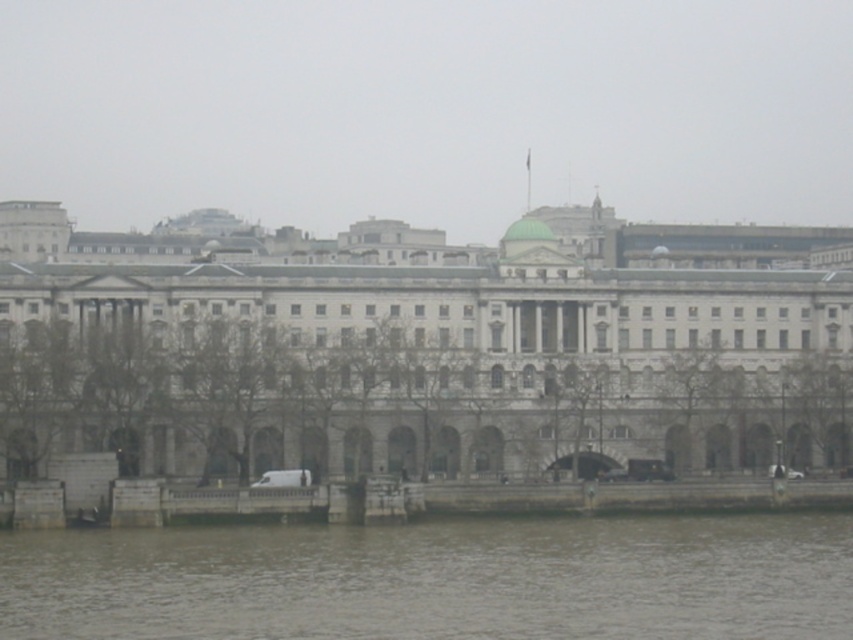
You are standing on the waterfront and want to take a photo of the white stone building at center and the gray water at lower center. Which object appears wider in the photo?

The white stone building at center appears wider in the photo because its width surpasses that of the gray water at lower center.

You are standing at the point marked as point (x=428, y=355) in the image. What is the closest object to you in the scene?

The closest object to you at point (x=428, y=355) is the white stone building at center, as it is located exactly at that coordinate.